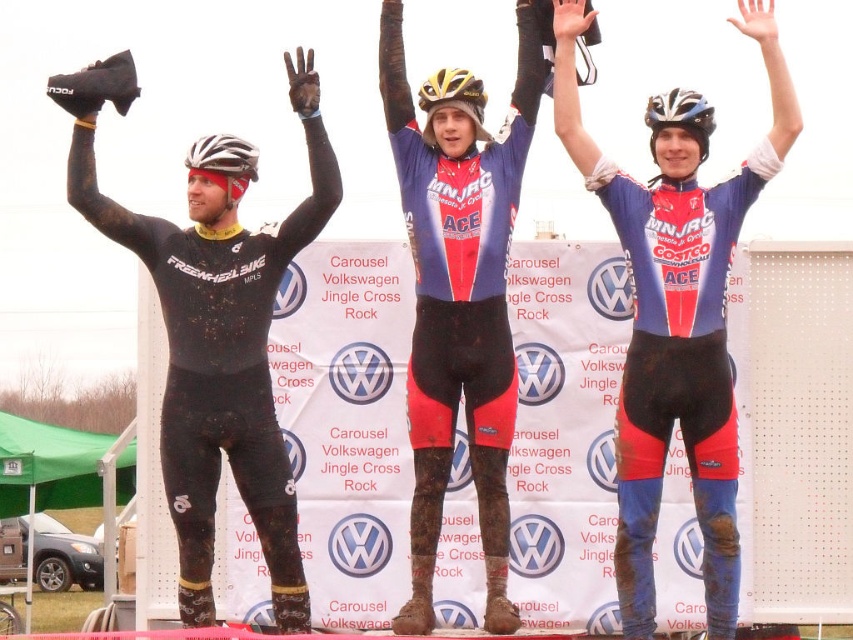
You are a photographer at the event and want to capture a closeup of the white matte bicycle helmet at upper left and the shiny blue helmet at center. Which helmet will appear larger in your photo?

The white matte bicycle helmet at upper left will appear larger in the photo because it is closer to the viewer than the shiny blue helmet at center.

You are a photographer standing at the starting line of the cyclocross race. You want to take a photo of the blue matte cycling suit at center. Where should you aim your camera to capture them in the frame?

The blue matte cycling suit at center is located at point (676,321), so you should aim your camera at those coordinates to capture them in the frame.